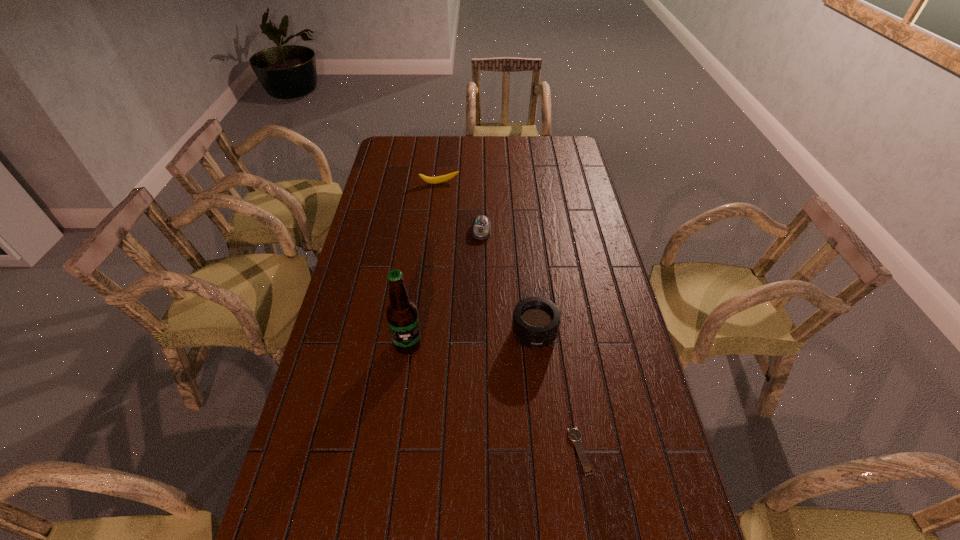
The height and width of the screenshot is (540, 960). Identify the location of vacant space on the desktop that is between the tallest object and the watch and is positioned on the upward curve of the third shortest object. (491, 395).

Locate an element on the screen. The width and height of the screenshot is (960, 540). vacant spot on the desktop that is between the tallest object and the watch and is positioned on the side of the second tallest object with brand markings and control switches is located at coordinates (485, 392).

At what (x,y) coordinates should I click in order to perform the action: click on free space on the desktop that is between the beer bottle and the shortest object and is positioned on the wheel side of the computer mouse. Please return your answer as a coordinate pair (x, y). The width and height of the screenshot is (960, 540). Looking at the image, I should click on (470, 383).